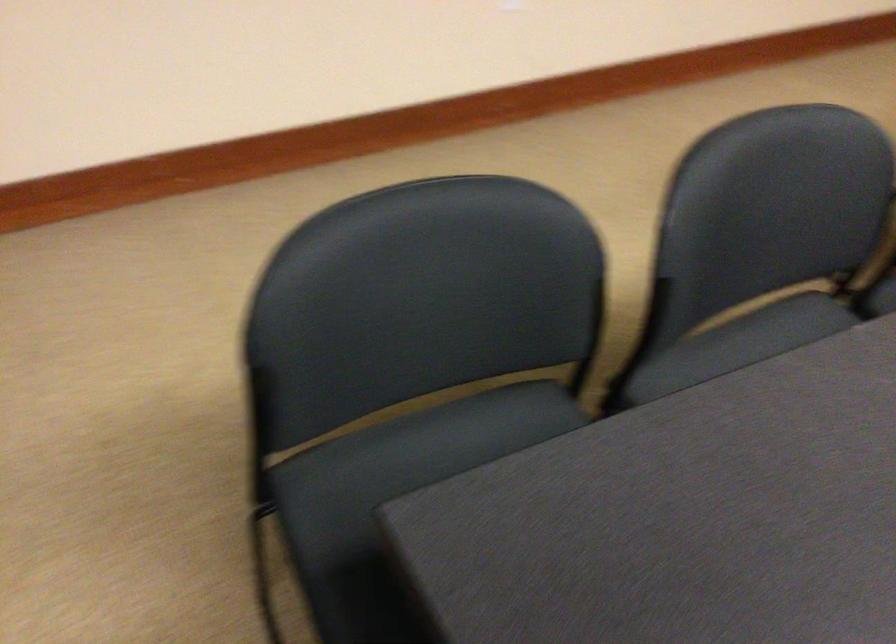
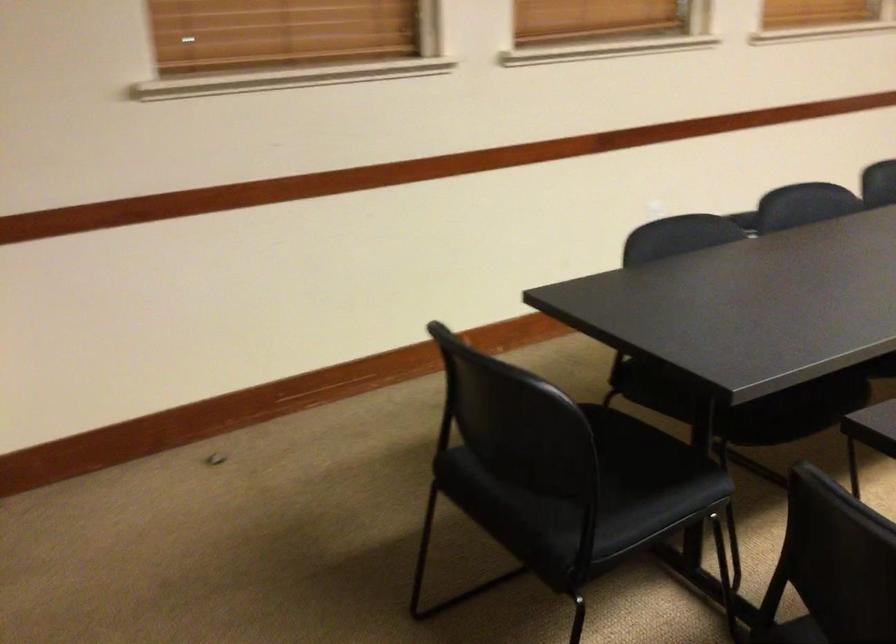
The first image is from the beginning of the video and the second image is from the end. How did the camera likely rotate when shooting the video?

The camera rotated toward right-down.